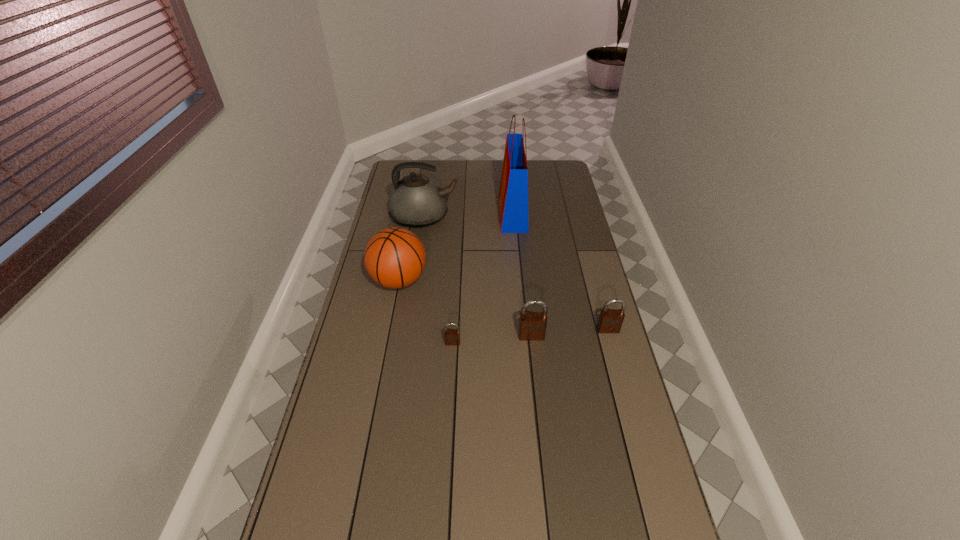
This screenshot has height=540, width=960. What are the coordinates of `free space located 0.270m on the front-facing side of the second padlock from left to right` in the screenshot? It's located at (540, 413).

At what (x,y) coordinates should I click in order to perform the action: click on vacant region located 0.390m on the front-facing side of the second shortest padlock. Please return your answer as a coordinate pair (x, y). This screenshot has height=540, width=960. Looking at the image, I should click on [639, 442].

Where is `vacant space situated on the front of the fourth shortest object`? Image resolution: width=960 pixels, height=540 pixels. vacant space situated on the front of the fourth shortest object is located at coordinates (393, 315).

Image resolution: width=960 pixels, height=540 pixels. In order to click on vacant space positioned on the handle side of the tallest object in this screenshot , I will do `click(475, 212)`.

Locate an element on the screen. This screenshot has height=540, width=960. vacant space located 0.270m on the handle side of the tallest object is located at coordinates (441, 212).

What are the coordinates of `vacant area located 0.060m on the handle side of the tallest object` in the screenshot? It's located at (486, 212).

Image resolution: width=960 pixels, height=540 pixels. Find the location of `free spot located 0.100m at the spout of the kettle`. free spot located 0.100m at the spout of the kettle is located at coordinates (481, 217).

Find the location of a particular element. The image size is (960, 540). basketball present at the left edge is located at coordinates (394, 257).

Locate an element on the screen. The height and width of the screenshot is (540, 960). kettle that is at the left edge is located at coordinates (416, 201).

Locate an element on the screen. object present at the right edge is located at coordinates pos(610,320).